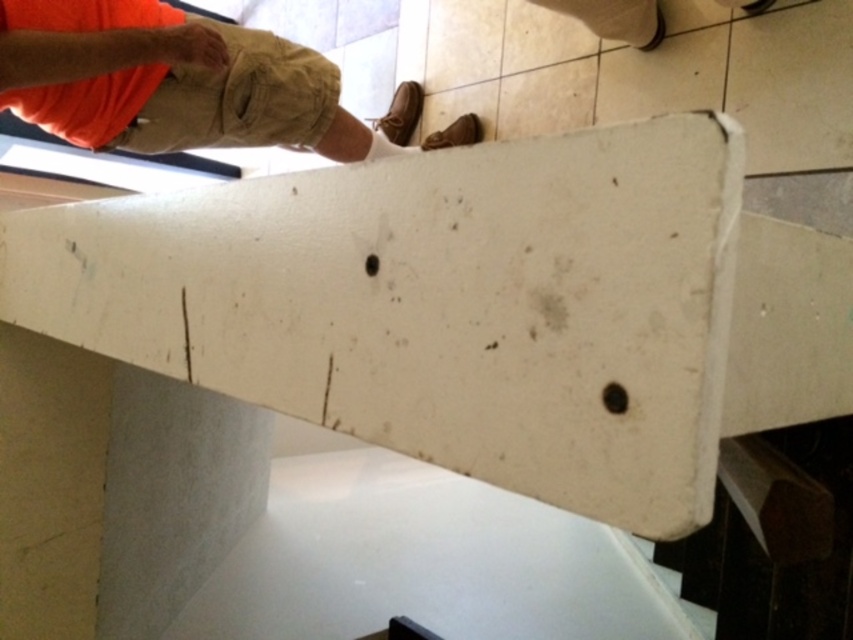
Question: Is white matte plank at upper center wider than matte orange hand at upper left?

Choices:
 (A) no
 (B) yes

Answer: (B)

Question: Is white matte plank at upper center thinner than orange cotton shirt at upper left?

Choices:
 (A) yes
 (B) no

Answer: (B)

Question: Which point is farther to the camera?

Choices:
 (A) orange cotton shirt at upper left
 (B) matte orange hand at upper left

Answer: (B)

Question: Which object is the closest to the white matte plank at upper center?

Choices:
 (A) orange cotton shirt at upper left
 (B) matte orange hand at upper left

Answer: (A)

Question: Can you confirm if white matte plank at upper center is thinner than orange cotton shirt at upper left?

Choices:
 (A) yes
 (B) no

Answer: (B)

Question: Which object appears closest to the camera in this image?

Choices:
 (A) orange cotton shirt at upper left
 (B) matte orange hand at upper left
 (C) white matte plank at upper center

Answer: (C)